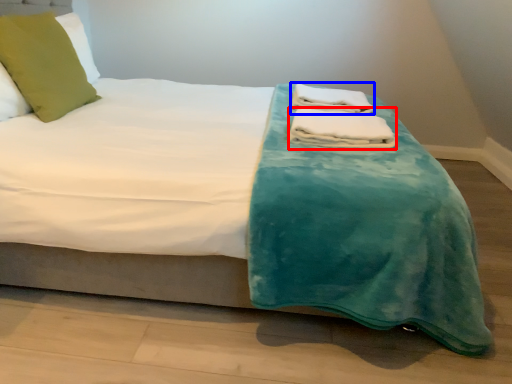
Question: Which object is further to the camera taking this photo, bath towel (highlighted by a red box) or bath towel (highlighted by a blue box)?

Choices:
 (A) bath towel
 (B) bath towel

Answer: (B)